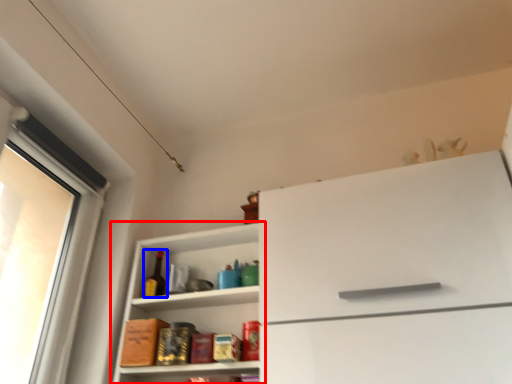
Question: Among these objects, which one is farthest to the camera, shelf (highlighted by a red box) or bottle (highlighted by a blue box)?

Choices:
 (A) shelf
 (B) bottle

Answer: (B)